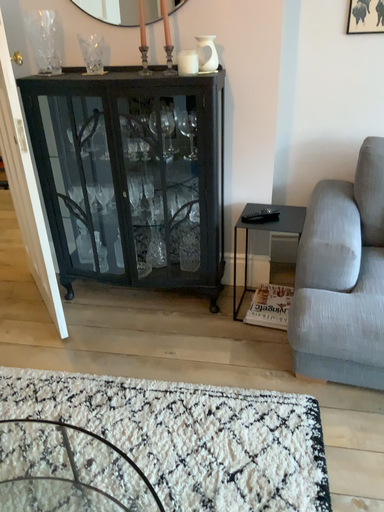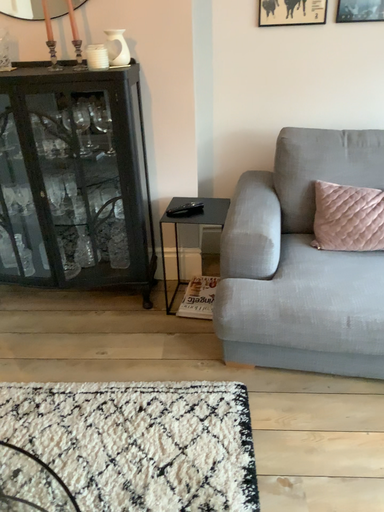
Question: Which way did the camera rotate in the video?

Choices:
 (A) rotated right
 (B) rotated left

Answer: (A)